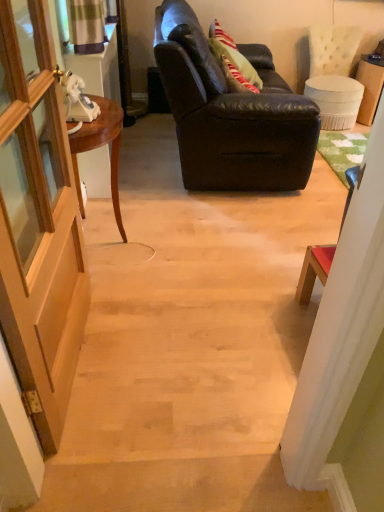
Question: Does point (284, 113) appear closer or farther from the camera than point (48, 296)?

Choices:
 (A) farther
 (B) closer

Answer: (A)

Question: From a real-world perspective, is leather couch at upper center positioned above or below wooden door at left?

Choices:
 (A) below
 (B) above

Answer: (A)

Question: Estimate the real-world distances between objects in this image. Which object is farther from the green textured curtain at upper left?

Choices:
 (A) wooden door at left
 (B) leather couch at upper center
 (C) mahogany wood desk at left

Answer: (A)

Question: Which is farther from the green textured curtain at upper left?

Choices:
 (A) mahogany wood desk at left
 (B) wooden door at left
 (C) leather couch at upper center

Answer: (B)